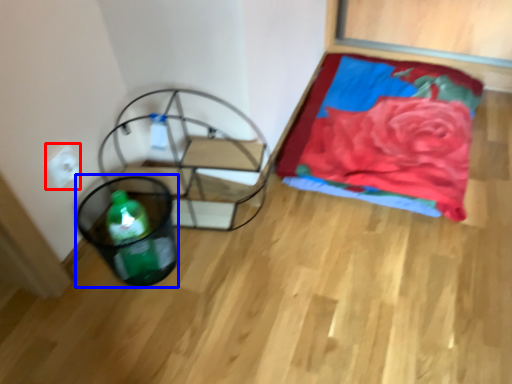
Question: Among these objects, which one is nearest to the camera, electric outlet (highlighted by a red box) or basket (highlighted by a blue box)?

Choices:
 (A) electric outlet
 (B) basket

Answer: (B)